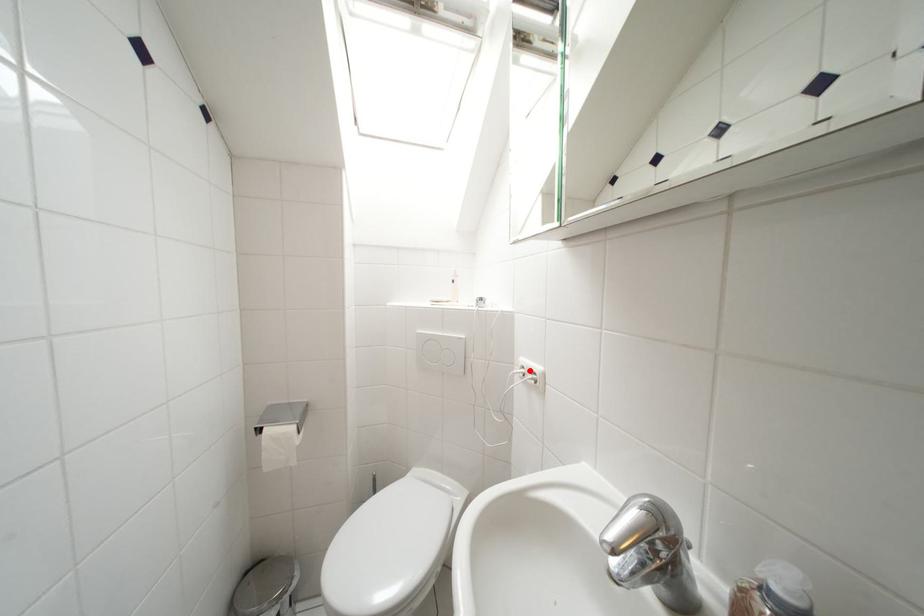
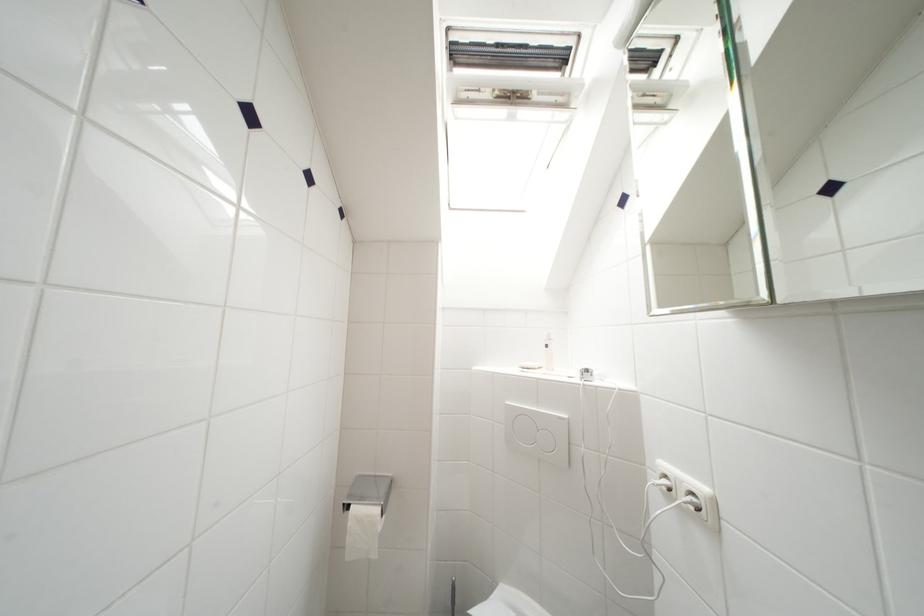
Where in the second image is the point corresponding to the highlighted location from the first image?

(672, 480)